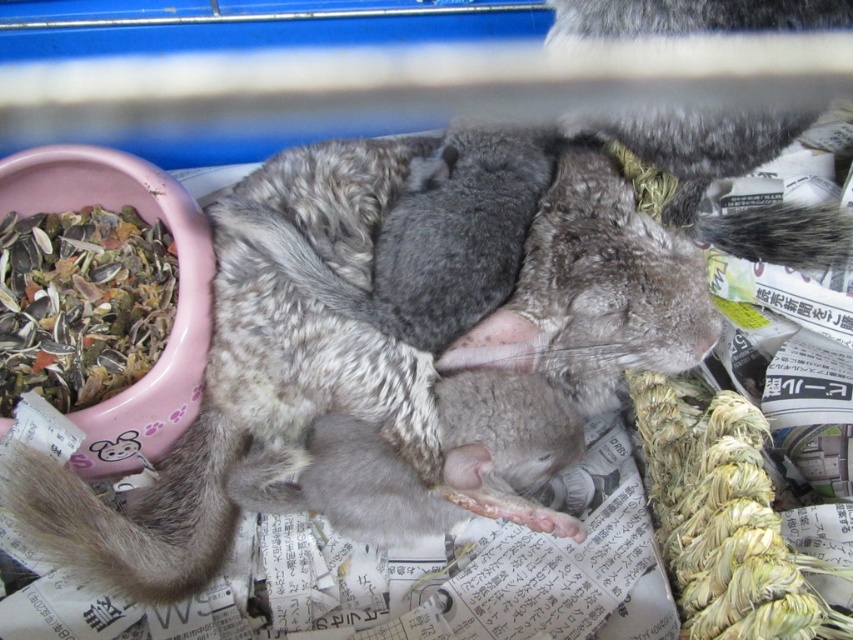
Between point (50, 305) and point (720, 218), which one is positioned in front?

Point (50, 305) is more forward.

Can you confirm if multicolored grain mix at left is thinner than gray fluffy tail at upper right?

No, multicolored grain mix at left is not thinner than gray fluffy tail at upper right.

Who is more distant from viewer, (x=62, y=349) or (x=741, y=211)?

Positioned behind is point (x=741, y=211).

Where is `multicolored grain mix at left`? Image resolution: width=853 pixels, height=640 pixels. multicolored grain mix at left is located at coordinates (80, 304).

Who is higher up, fuzzy gray tail at lower left or gray fluffy tail at upper right?

Positioned higher is gray fluffy tail at upper right.

Is the position of fuzzy gray tail at lower left more distant than that of gray fluffy tail at upper right?

No.

You are a GUI agent. You are given a task and a screenshot of the screen. Output one action in this format:
    pyautogui.click(x=<x>, y=<y>)
    Task: Click on the fuzzy gray tail at lower left
    
    Given the screenshot: What is the action you would take?
    pyautogui.click(x=134, y=515)

From the picture: Does multicolored grain mix at left have a lesser height compared to fuzzy gray tail at lower left?

No, multicolored grain mix at left is not shorter than fuzzy gray tail at lower left.

What do you see at coordinates (80, 304) in the screenshot?
I see `multicolored grain mix at left` at bounding box center [80, 304].

The image size is (853, 640). I want to click on multicolored grain mix at left, so click(80, 304).